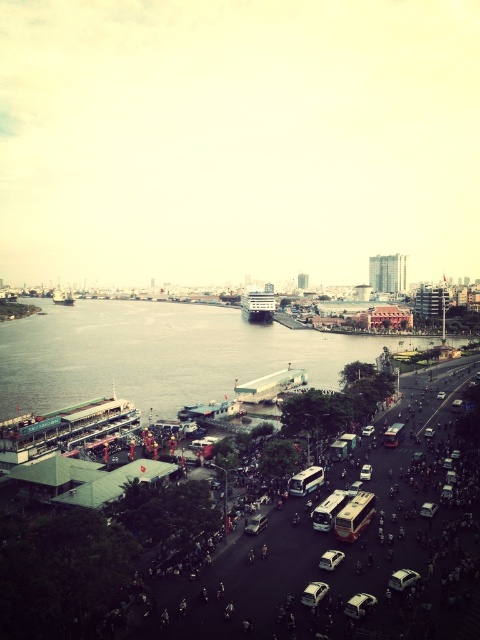
Can you confirm if gold metallic bus at center is positioned to the right of matte white bus at center?

In fact, gold metallic bus at center is to the left of matte white bus at center.

Find the location of a particular element. gold metallic bus at center is located at coordinates (355, 516).

Where is `gold metallic bus at center`? gold metallic bus at center is located at coordinates (355, 516).

Is the position of gold metallic bus at center more distant than that of metallic silver bus at center?

No, it is in front of metallic silver bus at center.

Does gold metallic bus at center have a greater width compared to metallic silver bus at center?

Yes, gold metallic bus at center is wider than metallic silver bus at center.

This screenshot has height=640, width=480. Describe the element at coordinates (355, 516) in the screenshot. I see `gold metallic bus at center` at that location.

At what (x,y) coordinates should I click in order to perform the action: click on gold metallic bus at center. Please return your answer as a coordinate pair (x, y). The width and height of the screenshot is (480, 640). Looking at the image, I should click on (355, 516).

Is metallic silver bus at center positioned before matte white bus at center?

Yes, it is in front of matte white bus at center.

The height and width of the screenshot is (640, 480). Find the location of `metallic silver bus at center`. metallic silver bus at center is located at coordinates (328, 509).

Where is `metallic silver bus at center`? The image size is (480, 640). metallic silver bus at center is located at coordinates (328, 509).